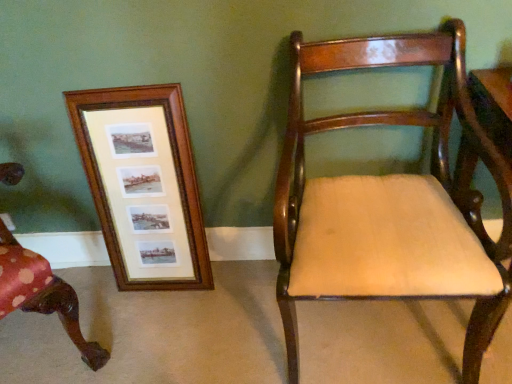
Question: Is wooden frame at left not close to mahogany wood chair at right, which is the 2th chair from left to right?

Choices:
 (A) no
 (B) yes

Answer: (A)

Question: Is wooden frame at left facing towards mahogany wood chair at right, the 1th chair viewed from the right?

Choices:
 (A) no
 (B) yes

Answer: (A)

Question: From the image's perspective, would you say wooden frame at left is shown under mahogany wood chair at right, the 1th chair viewed from the right?

Choices:
 (A) no
 (B) yes

Answer: (A)

Question: From a real-world perspective, does wooden frame at left sit lower than mahogany wood chair at right, which is the 2th chair from left to right?

Choices:
 (A) yes
 (B) no

Answer: (A)

Question: From a real-world perspective, is wooden frame at left on mahogany wood chair at right, which is the 2th chair from left to right?

Choices:
 (A) no
 (B) yes

Answer: (A)

Question: Looking at the image, does mahogany wood chair at right, which is the 2th chair from left to right, seem bigger or smaller compared to wooden chair at left, which is counted as the second chair, starting from the right?

Choices:
 (A) small
 (B) big

Answer: (B)

Question: From their relative heights in the image, would you say mahogany wood chair at right, which is the 2th chair from left to right, is taller or shorter than wooden chair at left, marked as the first chair in a left-to-right arrangement?

Choices:
 (A) short
 (B) tall

Answer: (A)

Question: Is mahogany wood chair at right, which is the 2th chair from left to right, inside the boundaries of wooden chair at left, marked as the first chair in a left-to-right arrangement, or outside?

Choices:
 (A) outside
 (B) inside

Answer: (A)

Question: From a real-world perspective, is mahogany wood chair at right, which is the 2th chair from left to right, above or below wooden chair at left, which is counted as the second chair, starting from the right?

Choices:
 (A) above
 (B) below

Answer: (B)

Question: Is mahogany wood chair at right, the 1th chair viewed from the right, wider or thinner than wooden frame at left?

Choices:
 (A) wide
 (B) thin

Answer: (A)

Question: From the image's perspective, is mahogany wood chair at right, which is the 2th chair from left to right, positioned above or below wooden frame at left?

Choices:
 (A) below
 (B) above

Answer: (A)

Question: Looking at the image, does mahogany wood chair at right, the 1th chair viewed from the right, seem bigger or smaller compared to wooden frame at left?

Choices:
 (A) small
 (B) big

Answer: (B)

Question: Is mahogany wood chair at right, the 1th chair viewed from the right, to the left or to the right of wooden frame at left in the image?

Choices:
 (A) left
 (B) right

Answer: (B)

Question: From the image's perspective, relative to wooden chair at left, marked as the first chair in a left-to-right arrangement, is wooden frame at left above or below?

Choices:
 (A) below
 (B) above

Answer: (B)

Question: Looking at the image, does wooden frame at left seem bigger or smaller compared to wooden chair at left, marked as the first chair in a left-to-right arrangement?

Choices:
 (A) big
 (B) small

Answer: (B)